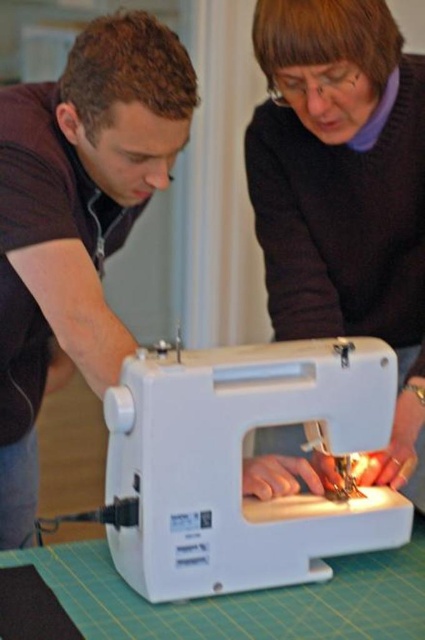
Question: Which point is farther to the camera?

Choices:
 (A) (62, 136)
 (B) (334, 387)
 (C) (266, 593)

Answer: (A)

Question: Based on their relative distances, which object is nearer to the matte black sewing machine at left?

Choices:
 (A) green cutting mat at lower center
 (B) matte black sewing machine at center
 (C) white plastic sewing machine at center

Answer: (C)

Question: Does matte black sewing machine at left have a greater width compared to green cutting mat at lower center?

Choices:
 (A) no
 (B) yes

Answer: (A)

Question: Is matte black sewing machine at center above white plastic sewing machine at center?

Choices:
 (A) yes
 (B) no

Answer: (A)

Question: Can you confirm if white plastic sewing machine at center is positioned to the left of green cutting mat at lower center?

Choices:
 (A) yes
 (B) no

Answer: (B)

Question: Estimate the real-world distances between objects in this image. Which object is closer to the green cutting mat at lower center?

Choices:
 (A) matte black sewing machine at left
 (B) white plastic sewing machine at center
 (C) matte black sewing machine at center

Answer: (B)